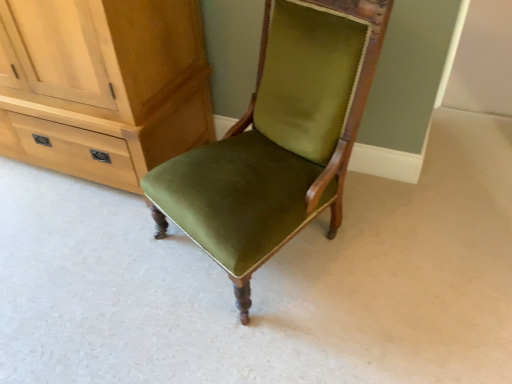
You are a GUI agent. You are given a task and a screenshot of the screen. Output one action in this format:
    pyautogui.click(x=<x>, y=<y>)
    Task: Click on the free space in front of velvet green chair at center
    
    Given the screenshot: What is the action you would take?
    pyautogui.click(x=278, y=336)